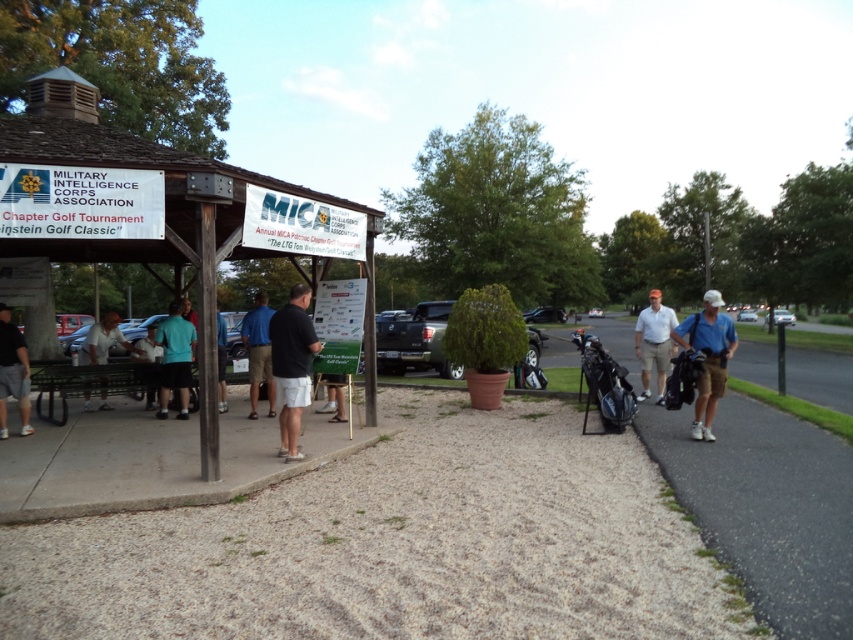
You are a photographer at the MICA Golf Classic event. You need to position yourself so that both the light blue shirt at right and the blue shirt at center are visible in your shot. Based on their positions, which shirt should you ensure is closer to the left side of your camera frame?

The blue shirt at center should be closer to the left side of your camera frame because the light blue shirt at right is positioned to its right, meaning the blue shirt at center is to the left of the light blue shirt at right.

What is located at the coordinates point (292, 365)?

The black matte shirt at center is located at point (292, 365).